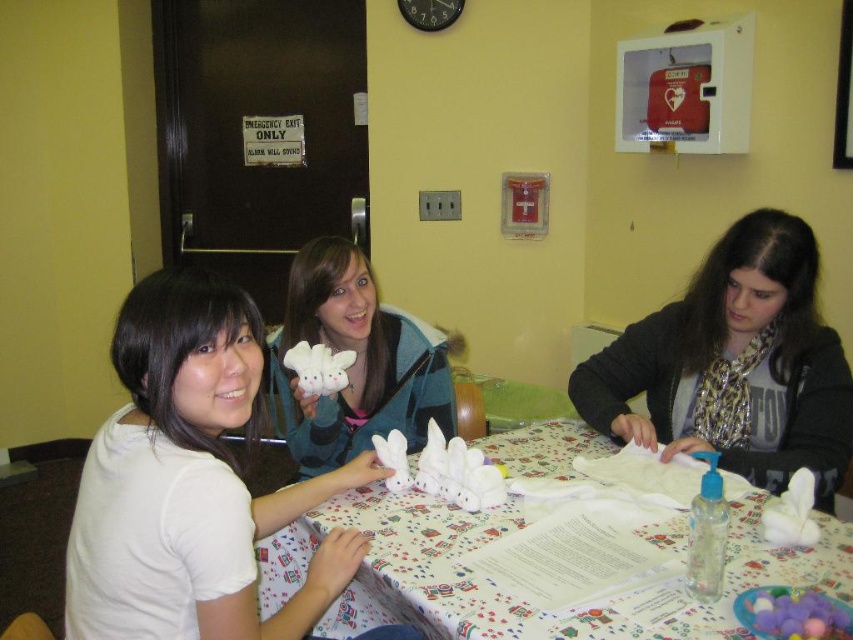
Question: Which point appears closest to the camera in this image?

Choices:
 (A) [x=454, y=536]
 (B) [x=357, y=429]
 (C) [x=642, y=381]
 (D) [x=221, y=472]

Answer: (D)

Question: Among these objects, which one is nearest to the camera?

Choices:
 (A) white paper towel at center
 (B) matte black scarf at center
 (C) white plush toy at center

Answer: (A)

Question: Is matte black scarf at center below white paper towel at center?

Choices:
 (A) yes
 (B) no

Answer: (B)

Question: Can you confirm if white matte shirt at left is positioned to the left of white paper towel at center?

Choices:
 (A) yes
 (B) no

Answer: (A)

Question: Which is farther from the matte black scarf at center?

Choices:
 (A) white paper towel at center
 (B) white plush toy at center
 (C) white matte shirt at left

Answer: (C)

Question: Is white matte shirt at left further to camera compared to white plush toy at center?

Choices:
 (A) no
 (B) yes

Answer: (A)